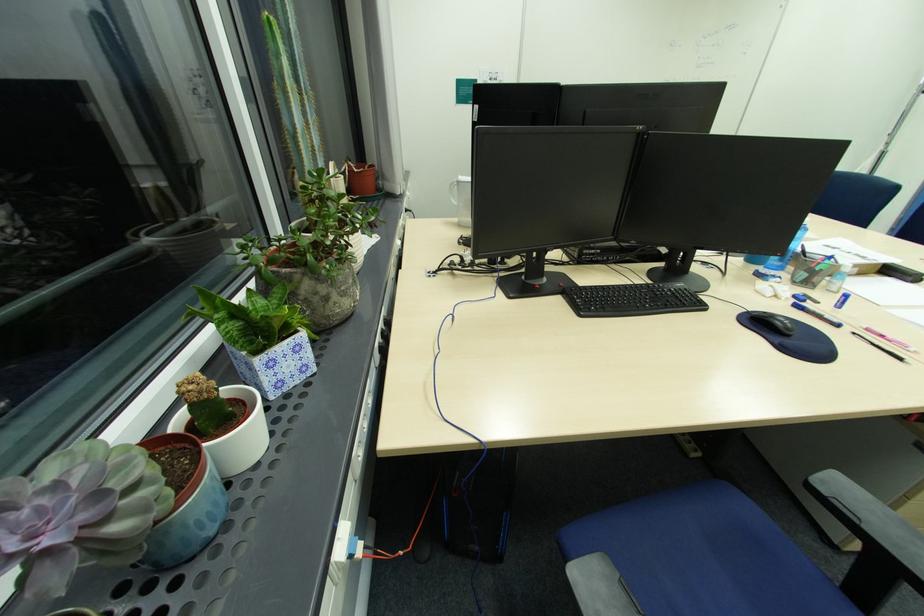
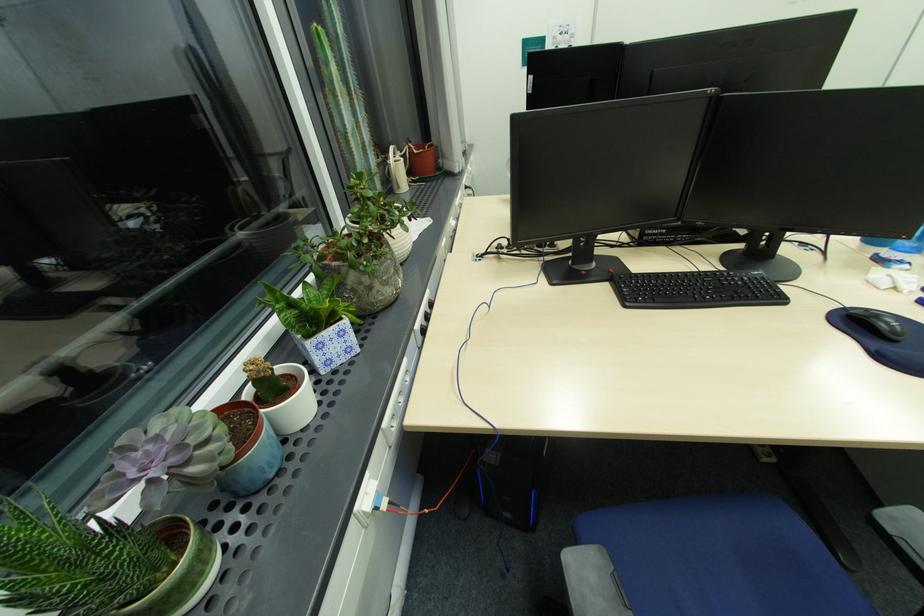
The point at (771, 313) is marked in the first image. Where is the corresponding point in the second image?

(872, 310)